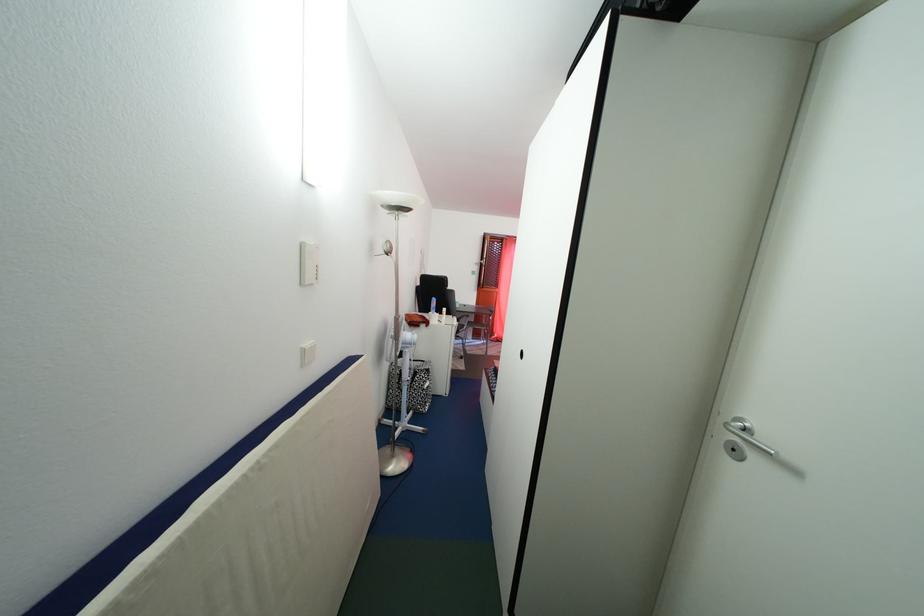
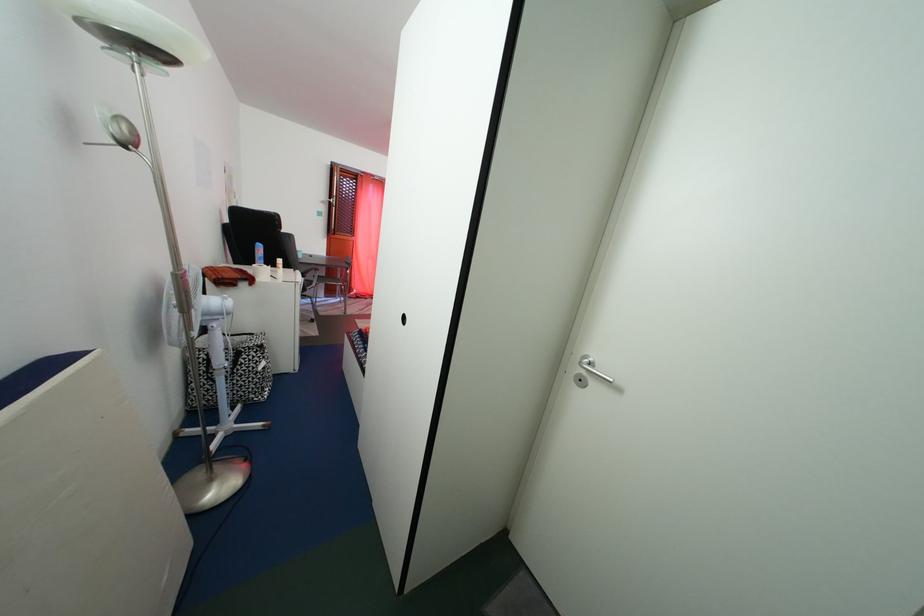
Question: The camera is either moving clockwise (left) or counter-clockwise (right) around the object. The first image is from the beginning of the video and the second image is from the end. Is the camera moving left or right when shooting the video?

Choices:
 (A) Left
 (B) Right

Answer: (A)